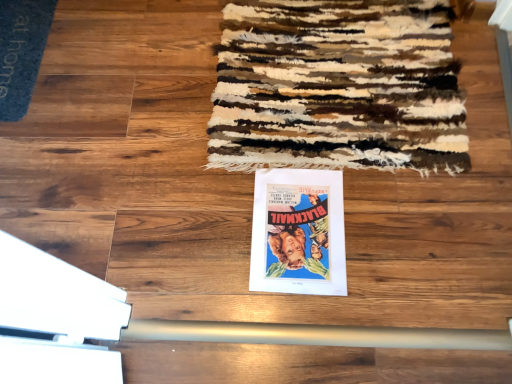
Question: Would you say matte paper poster at center is inside or outside textured woolen mat at upper center?

Choices:
 (A) inside
 (B) outside

Answer: (B)

Question: From a real-world perspective, relative to textured woolen mat at upper center, is matte paper poster at center vertically above or below?

Choices:
 (A) above
 (B) below

Answer: (B)

Question: Based on their relative distances, which object is nearer to the matte paper poster at center?

Choices:
 (A) textured woolen mat at upper center
 (B) blue carpet at upper left

Answer: (A)

Question: Based on their relative distances, which object is farther from the matte paper poster at center?

Choices:
 (A) blue carpet at upper left
 (B) textured woolen mat at upper center

Answer: (A)